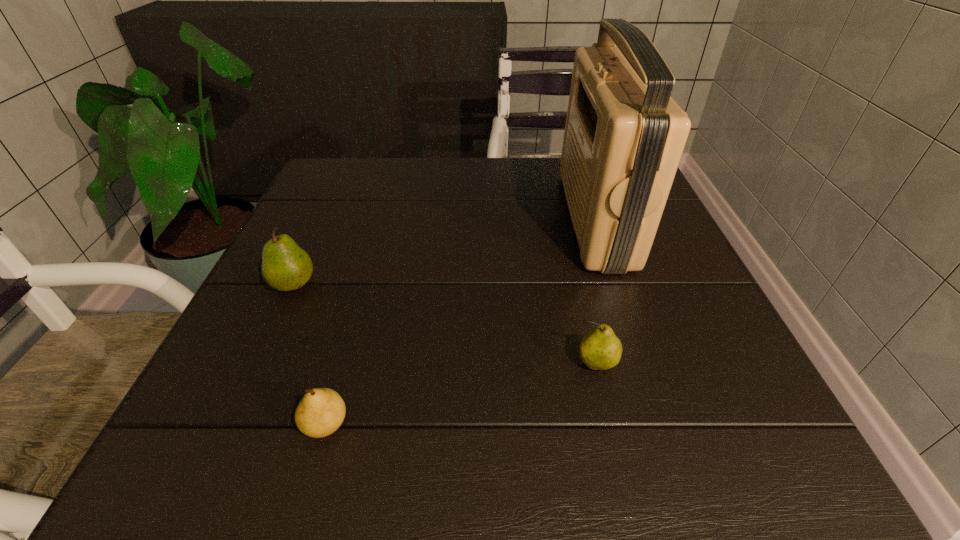
Find the location of a particular element. vacant area at the left edge is located at coordinates (309, 348).

Locate an element on the screen. The height and width of the screenshot is (540, 960). free space at the right edge is located at coordinates (689, 318).

At what (x,y) coordinates should I click in order to perform the action: click on vacant space at the far left corner. Please return your answer as a coordinate pair (x, y). Image resolution: width=960 pixels, height=540 pixels. Looking at the image, I should click on (366, 193).

You are a GUI agent. You are given a task and a screenshot of the screen. Output one action in this format:
    pyautogui.click(x=<x>, y=<y>)
    Task: Click on the free space between the second object from left to right and the tallest object
    Image resolution: width=960 pixels, height=540 pixels.
    Given the screenshot: What is the action you would take?
    pyautogui.click(x=461, y=321)

This screenshot has height=540, width=960. What are the coordinates of `empty location between the second nearest pear and the tallest object` in the screenshot? It's located at (595, 292).

Find the location of a particular element. empty space that is in between the second object from left to right and the farthest pear is located at coordinates (309, 354).

What are the coordinates of `free spot between the radio receiver and the leftmost pear` in the screenshot? It's located at (444, 252).

At what (x,y) coordinates should I click in order to perform the action: click on blank region between the radio receiver and the farthest pear. Please return your answer as a coordinate pair (x, y). Image resolution: width=960 pixels, height=540 pixels. Looking at the image, I should click on (444, 252).

This screenshot has height=540, width=960. I want to click on vacant area that lies between the tallest pear and the nearest pear, so pyautogui.click(x=309, y=354).

Identify the location of vacant point located between the second pear from right to left and the tallest object. (461, 321).